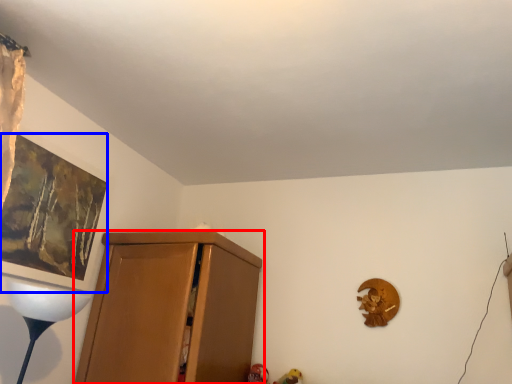
Question: Among these objects, which one is nearest to the camera, cupboard (highlighted by a red box) or picture frame (highlighted by a blue box)?

Choices:
 (A) cupboard
 (B) picture frame

Answer: (B)